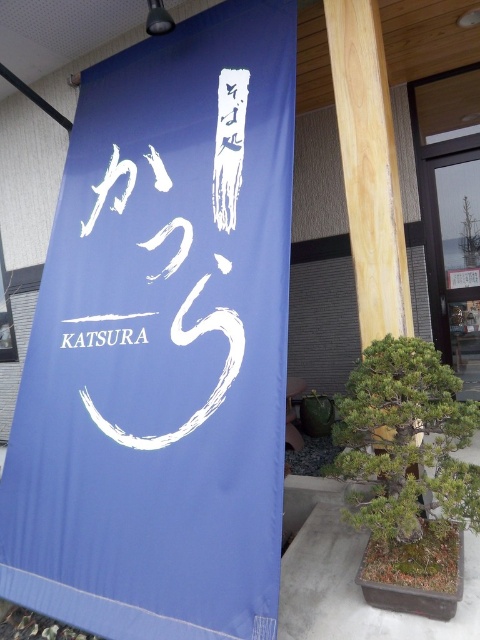
Question: Which object is the closest to the green leafy plant at lower right?

Choices:
 (A) white paper at center
 (B) blue fabric sign at center

Answer: (B)

Question: Based on their relative distances, which object is nearer to the green leafy plant at lower right?

Choices:
 (A) blue fabric sign at center
 (B) white paper at center

Answer: (A)

Question: Is blue fabric sign at center thinner than white paper at center?

Choices:
 (A) no
 (B) yes

Answer: (A)

Question: Estimate the real-world distances between objects in this image. Which object is closer to the blue fabric sign at center?

Choices:
 (A) white paper at center
 (B) green leafy plant at lower right

Answer: (A)

Question: Does blue fabric sign at center have a greater width compared to green leafy plant at lower right?

Choices:
 (A) no
 (B) yes

Answer: (B)

Question: Does green leafy plant at lower right appear over white paper at center?

Choices:
 (A) no
 (B) yes

Answer: (A)